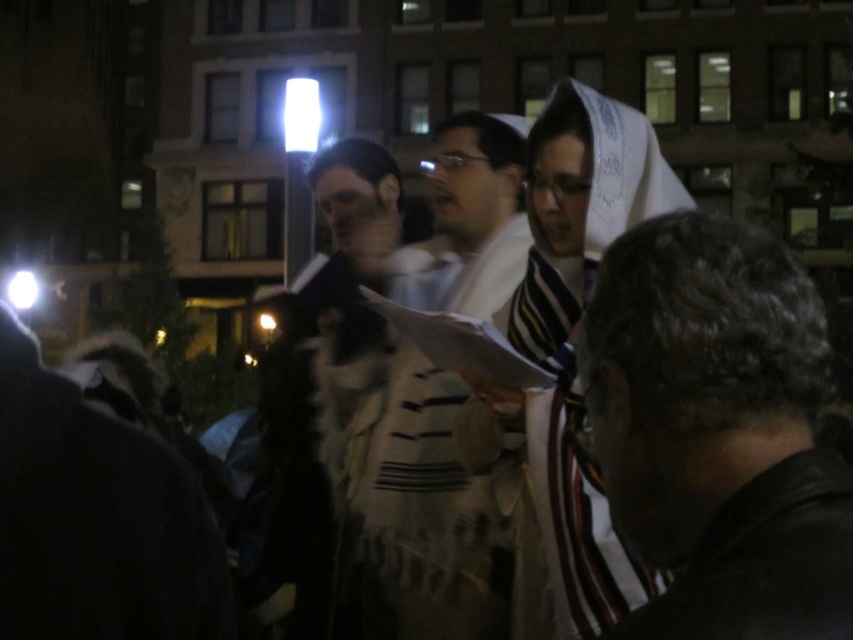
You are standing in the nighttime urban scene with the multi story building in the background. You see a dark brown leather jacket at lower right. Where exactly is the dark brown leather jacket located in terms of coordinates?

The dark brown leather jacket at lower right is located at coordinates point (718, 433).

You are an observer standing in the middle of the scene. You notice two items at the center of the image. Which one is bigger between the white textured scarf at center and the striped woolen shawl at center?

The white textured scarf at center has a larger size compared to the striped woolen shawl at center, so the white textured scarf at center is bigger.

You are standing in the nighttime urban scene with a building and people in prayer shawls. You see two points marked in the image. Which point is closer to you, point (706,442) or point (843,468)?

Point (706,442) is closer to you than point (843,468) because it is further to the viewer according to the description.